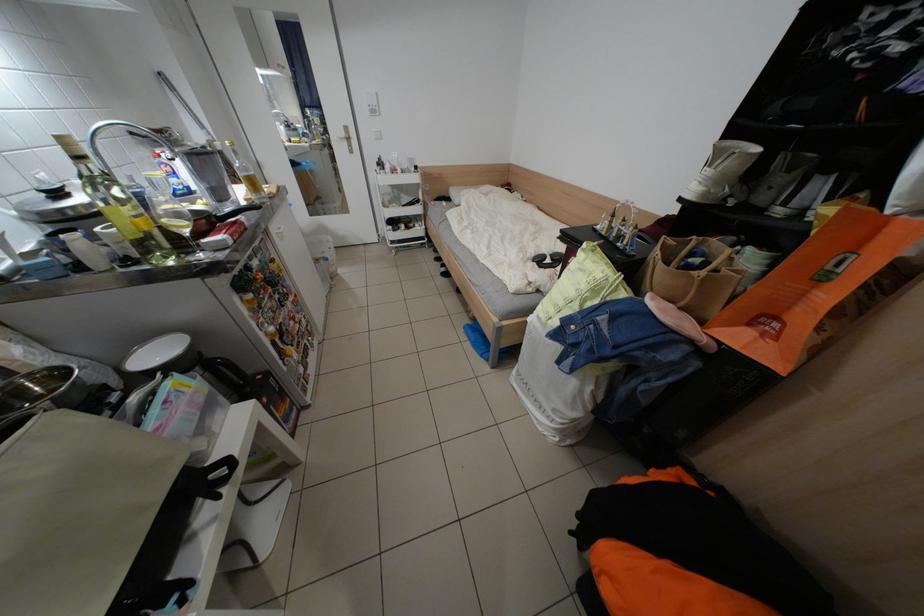
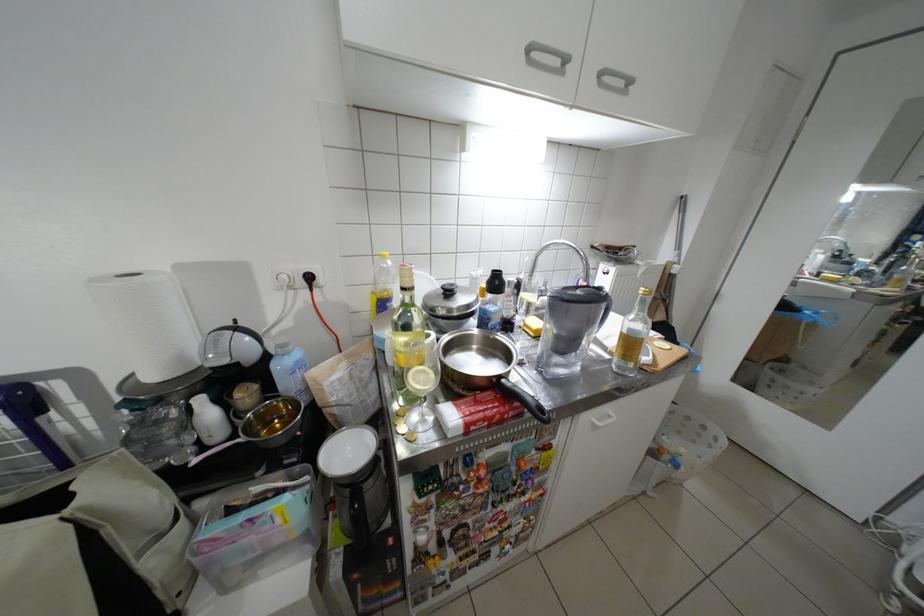
In the second image, find the point that corresponds to [258,230] in the first image.

(532, 415)